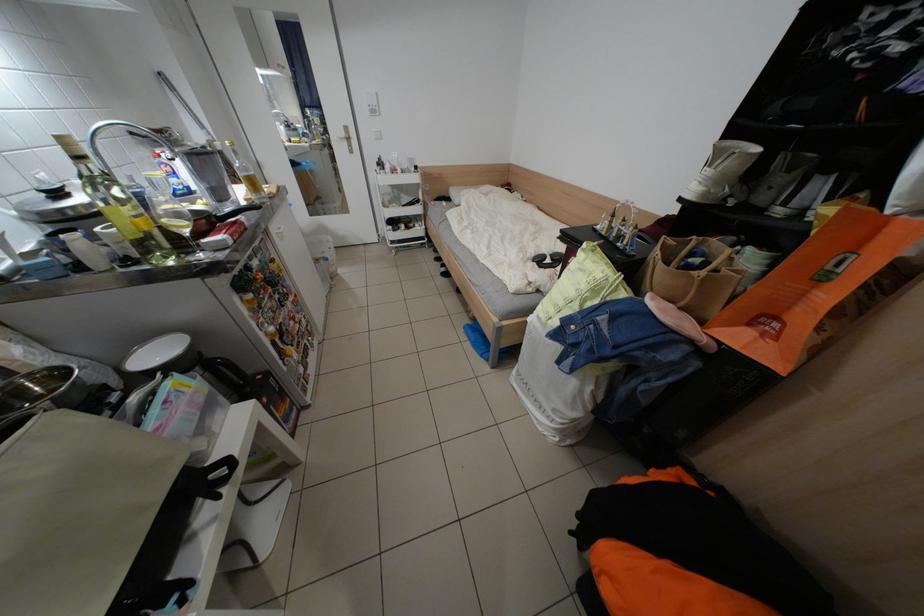
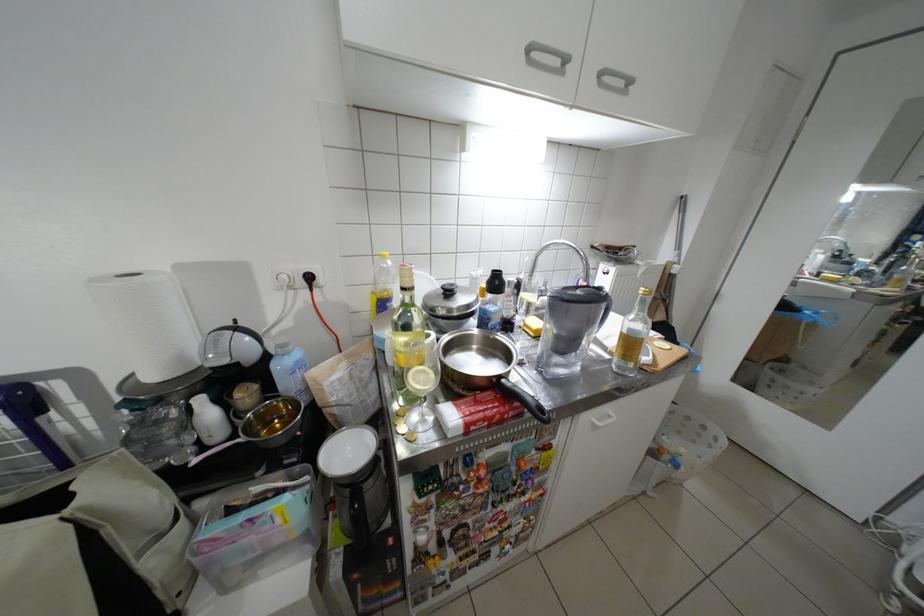
In the second image, find the point that corresponds to [258,230] in the first image.

(532, 415)